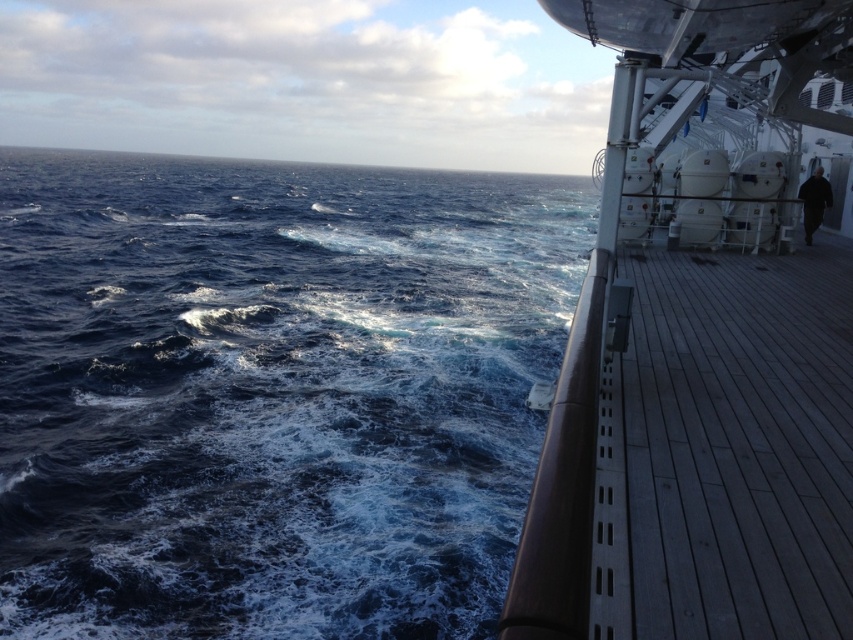
Looking at this image, you are standing on the ship deck and want to know which of the two points, point (167, 260) or point (691, 285), is closer to you. Based on the scene, which one is nearer?

Point (167, 260) is closer to you because it is further to the viewer than point (691, 285).

You are standing on the deck of the ship and notice the dark blue water at left and the wooden at right. Which object is higher from the deck?

The dark blue water at left is located above the wooden at right, so the dark blue water at left is higher from the deck.